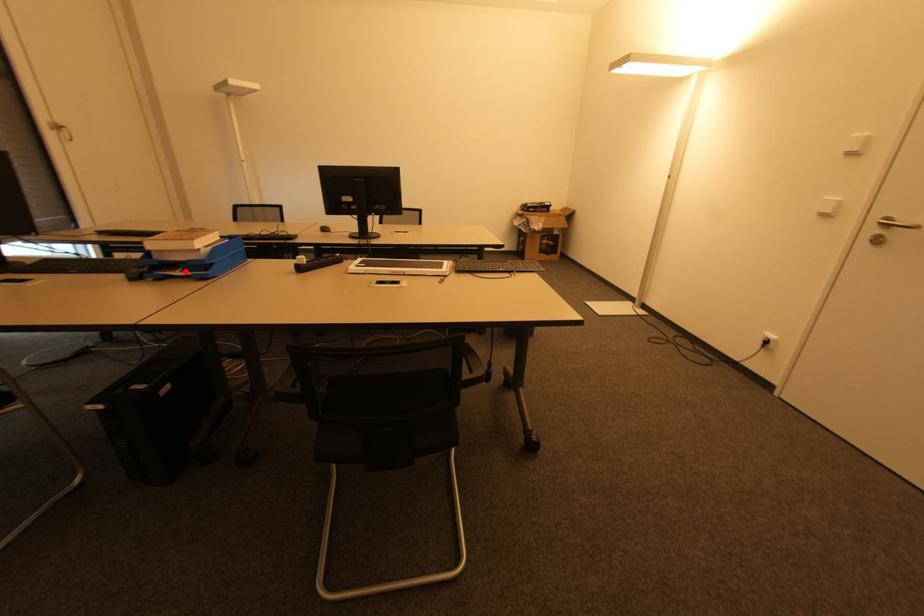
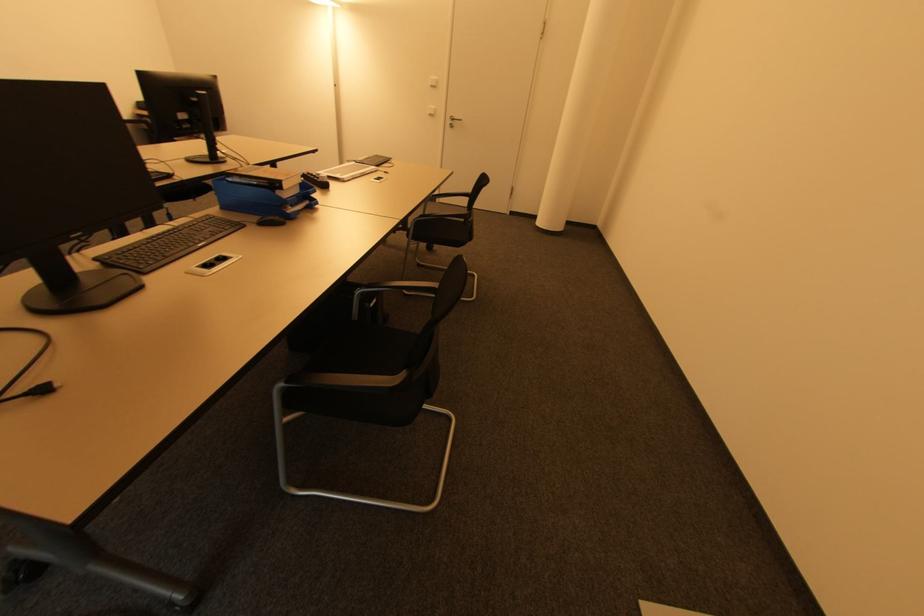
Question: I am providing you with two images of the same scene from different viewpoints. In image1, a red point is highlighted. Considering the same 3D point in image2, which of the following is correct?

Choices:
 (A) It is closer
 (B) It is farther

Answer: (A)